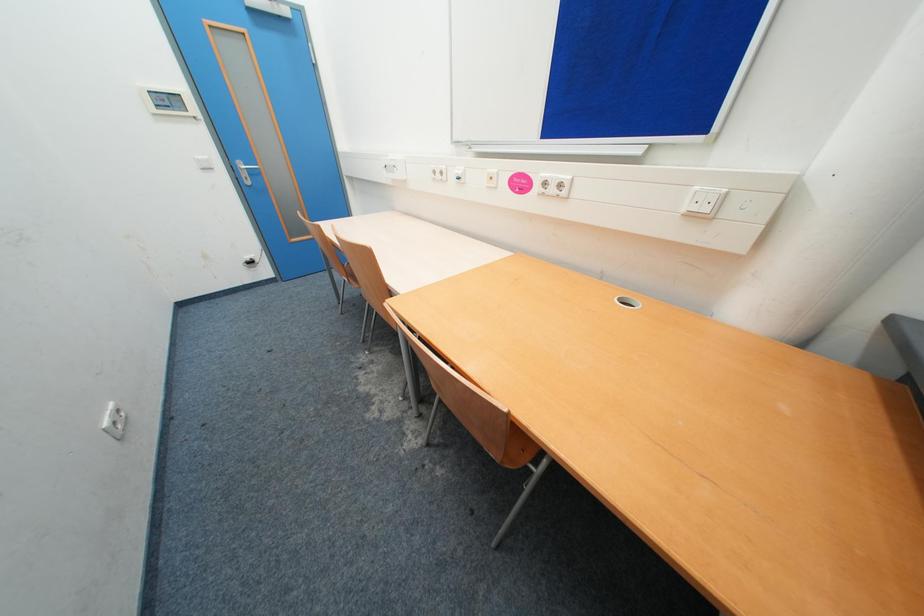
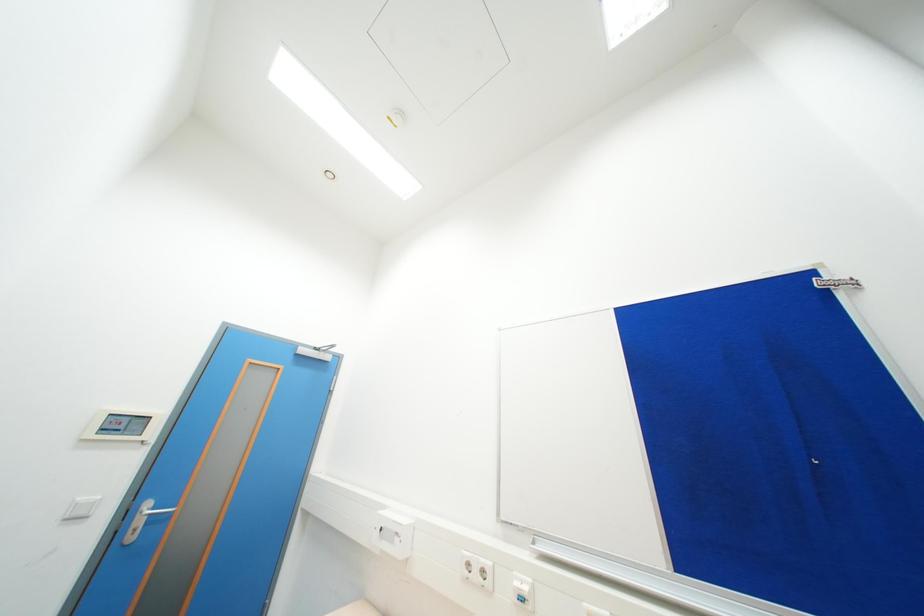
Question: How did the camera likely rotate?

Choices:
 (A) Left
 (B) Right
 (C) Up
 (D) Down

Answer: (C)